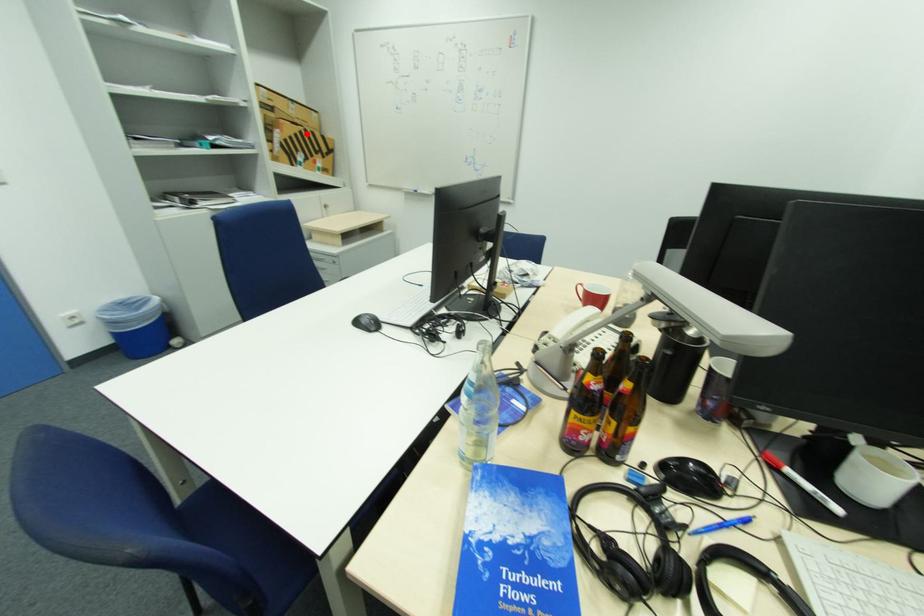
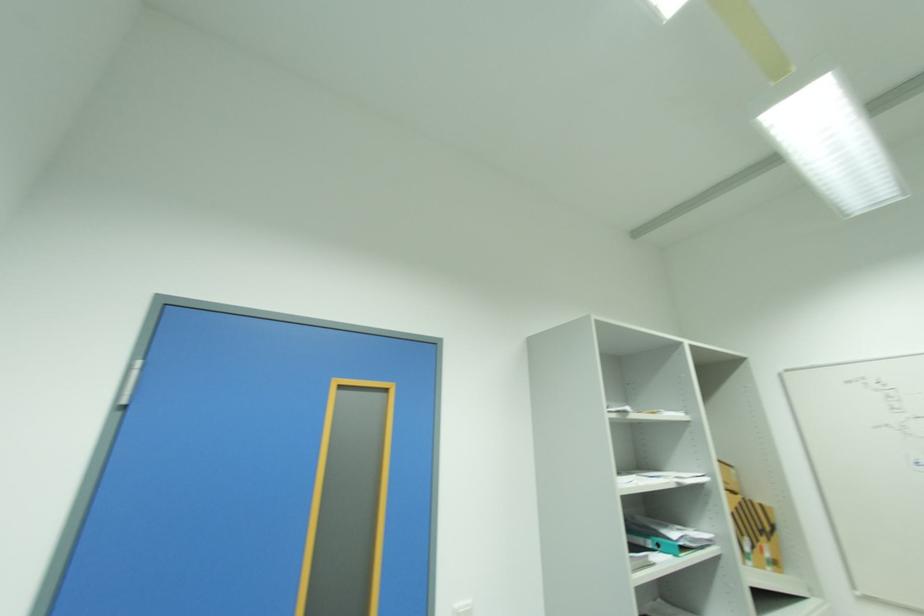
Question: I am providing you with two images of the same scene from different viewpoints. A red point is marked on the first image. Is the red point's position out of view in image 2?

Choices:
 (A) Yes
 (B) No

Answer: (B)